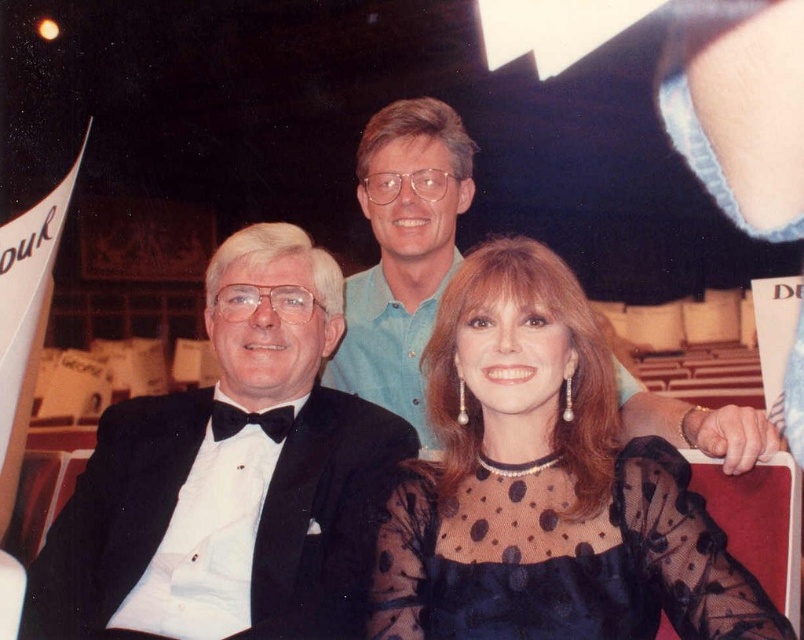
You are attending a formal event and want to take a photo with the black sheer dress at center and the light blue shirt at upper center. Which one is positioned lower in the image?

The black sheer dress at center is located below the light blue shirt at upper center, so the black sheer dress at center is positioned lower in the image.

You are a photographer at a formal event. You need to adjust the camera focus between the black sheer dress at center and the black satin tuxedo at left. Can you focus on both at the same time if the camera can focus on objects within 15 inches of each other?

The black sheer dress at center is 14.86 inches from the black satin tuxedo at left, so yes, the camera can focus on both since they are within the 15 inches range.